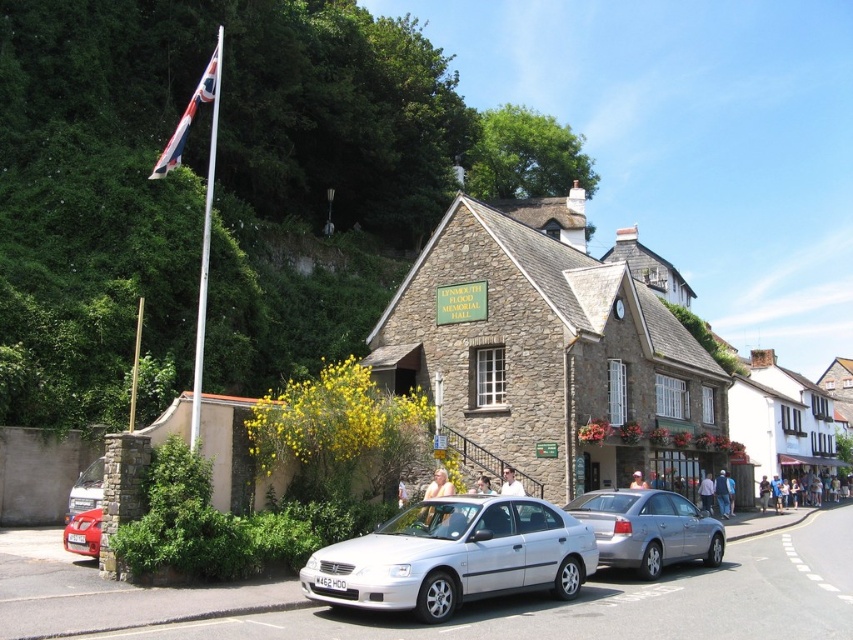
Question: Which of the following is the farthest from the observer?

Choices:
 (A) union jack fabric flag at upper left
 (B) silver metallic car at lower left
 (C) metallic silver sedan at center
 (D) silver metallic car at center

Answer: (A)

Question: Estimate the real-world distances between objects in this image. Which object is farther from the silver metallic car at center?

Choices:
 (A) metallic silver sedan at center
 (B) union jack fabric flag at upper left

Answer: (B)

Question: Considering the real-world distances, which object is farthest from the silver metallic car at center?

Choices:
 (A) metallic silver sedan at center
 (B) silver metallic sedan at center

Answer: (A)

Question: Does silver metallic car at center come in front of union jack fabric flag at upper left?

Choices:
 (A) no
 (B) yes

Answer: (B)

Question: Does silver metallic car at center appear on the right side of silver metallic sedan at center?

Choices:
 (A) no
 (B) yes

Answer: (A)

Question: Is silver metallic car at center closer to camera compared to union jack fabric flag at upper left?

Choices:
 (A) yes
 (B) no

Answer: (A)